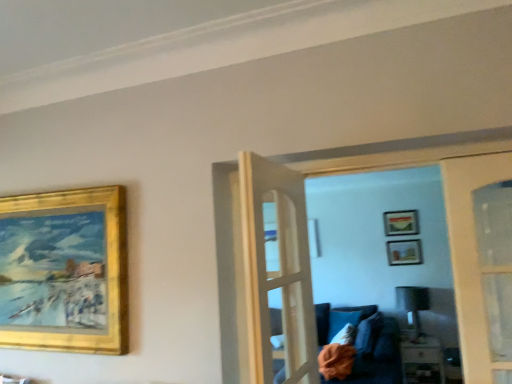
What do you see at coordinates (404, 252) in the screenshot?
I see `matte gold picture frame at upper center, the second picture frame in the front-to-back sequence` at bounding box center [404, 252].

In order to click on matte gold picture frame at upper center, which is counted as the 3th picture frame, starting from the front in this screenshot , I will do `click(401, 222)`.

This screenshot has width=512, height=384. What are the coordinates of `the 1st picture frame behind the matte black lamp at center` in the screenshot? It's located at (404, 252).

Which is behind, matte black lamp at center or matte gold picture frame at upper center, which ranks as the second picture frame in back-to-front order?

matte gold picture frame at upper center, which ranks as the second picture frame in back-to-front order, is further from the camera.

Is matte black lamp at center next to matte gold picture frame at upper center, the second picture frame in the front-to-back sequence?

No.

Based on the photo, which is farther, (400,221) or (83,295)?

The point (400,221) is farther.

This screenshot has height=384, width=512. I want to click on picture frame above the matte gold picture frame at upper center, which is counted as the 3th picture frame, starting from the front (from the image's perspective), so click(68, 268).

Consider the image. Between matte gold picture frame at upper center, acting as the first picture frame starting from the back, and gold/gilded picture frame at upper left, marked as the 3th picture frame in a back-to-front arrangement, which one appears on the right side from the viewer's perspective?

From the viewer's perspective, matte gold picture frame at upper center, acting as the first picture frame starting from the back, appears more on the right side.

Could you tell me if wooden table at lower right is facing white fabric pillow at lower center?

No, wooden table at lower right is not turned towards white fabric pillow at lower center.

Is wooden table at lower right placed right next to white fabric pillow at lower center?

wooden table at lower right and white fabric pillow at lower center are not in contact.

Is point (403, 349) less distant than point (334, 335)?

Yes, it is.

Can you tell me how much wooden table at lower right and white fabric pillow at lower center differ in facing direction?

5.2 degrees separate the facing orientations of wooden table at lower right and white fabric pillow at lower center.

Consider the image. From the image's perspective, is gold/gilded picture frame at upper left, the first picture frame from the left, located beneath white fabric pillow at lower center?

Incorrect, from the image's perspective, gold/gilded picture frame at upper left, the first picture frame from the left, is higher than white fabric pillow at lower center.

From a real-world perspective, does gold/gilded picture frame at upper left, marked as the 3th picture frame in a back-to-front arrangement, sit lower than white fabric pillow at lower center?

No, from a real-world perspective, gold/gilded picture frame at upper left, marked as the 3th picture frame in a back-to-front arrangement, is not beneath white fabric pillow at lower center.

Between gold/gilded picture frame at upper left, the third picture frame in the right-to-left sequence, and white fabric pillow at lower center, which one has smaller width?

gold/gilded picture frame at upper left, the third picture frame in the right-to-left sequence, is thinner.

Could white fabric pillow at lower center be considered to be inside gold/gilded picture frame at upper left, which is counted as the 1th picture frame, starting from the front?

No, gold/gilded picture frame at upper left, which is counted as the 1th picture frame, starting from the front, does not contain white fabric pillow at lower center.

Who is smaller, matte gold picture frame at upper center, acting as the first picture frame starting from the back, or wooden table at lower right?

matte gold picture frame at upper center, acting as the first picture frame starting from the back.

Considering the positions of point (392, 229) and point (419, 341), is point (392, 229) closer or farther from the camera than point (419, 341)?

Point (392, 229) is farther from the camera than point (419, 341).

From a real-world perspective, who is located lower, matte gold picture frame at upper center, acting as the first picture frame starting from the back, or wooden table at lower right?

From a 3D spatial view, wooden table at lower right is below.

Does matte gold picture frame at upper center, which is the second picture frame from right to left, have a greater height compared to wooden table at lower right?

No.

Find the location of a particular element. Image resolution: width=512 pixels, height=384 pixels. the 1st picture frame behind the matte black lamp at center, starting your count from the anchor is located at coordinates (404, 252).

Is the depth of matte gold picture frame at upper center, which ranks as the second picture frame in back-to-front order, greater than that of matte black lamp at center?

That is True.

Consider the image. Does matte gold picture frame at upper center, the third picture frame viewed from the left, have a greater height compared to matte black lamp at center?

No.

Between matte black lamp at center and matte gold picture frame at upper center, positioned as the second picture frame in left-to-right order, which one has smaller size?

matte gold picture frame at upper center, positioned as the second picture frame in left-to-right order.

Is point (410, 299) positioned behind point (385, 229)?

No, (410, 299) is closer to viewer.

How many degrees apart are the facing directions of matte black lamp at center and matte gold picture frame at upper center, which is the second picture frame from right to left?

6.57 degrees separate the facing orientations of matte black lamp at center and matte gold picture frame at upper center, which is the second picture frame from right to left.

From a real-world perspective, between matte black lamp at center and matte gold picture frame at upper center, positioned as the second picture frame in left-to-right order, who is vertically higher?

From a 3D spatial view, matte gold picture frame at upper center, positioned as the second picture frame in left-to-right order, is above.

At what (x,y) coordinates should I click in order to perform the action: click on lamp that appears below the matte gold picture frame at upper center, the second picture frame in the front-to-back sequence (from the image's perspective). Please return your answer as a coordinate pair (x, y). This screenshot has height=384, width=512. Looking at the image, I should click on (412, 307).

You are a GUI agent. You are given a task and a screenshot of the screen. Output one action in this format:
    pyautogui.click(x=<x>, y=<y>)
    Task: Click on the picture frame that is the 1st one below the matte gold picture frame at upper center, acting as the first picture frame starting from the back (from a real-world perspective)
    The width and height of the screenshot is (512, 384).
    Given the screenshot: What is the action you would take?
    pyautogui.click(x=68, y=268)

From the image, which object appears to be nearer to matte gold picture frame at upper center, the second picture frame in the front-to-back sequence, matte black lamp at center or matte gold picture frame at upper center, positioned as the second picture frame in left-to-right order?

matte gold picture frame at upper center, positioned as the second picture frame in left-to-right order, is positioned closer to the anchor matte gold picture frame at upper center, the second picture frame in the front-to-back sequence.

Based on the photo, estimate the real-world distances between objects in this image. Which object is further from matte gold picture frame at upper center, acting as the 1th picture frame starting from the right, wooden table at lower right or matte black lamp at center?

wooden table at lower right is positioned further to the anchor matte gold picture frame at upper center, acting as the 1th picture frame starting from the right.

Estimate the real-world distances between objects in this image. Which object is further from matte gold picture frame at upper center, positioned as the second picture frame in left-to-right order, wooden table at lower right or gold/gilded picture frame at upper left, the first picture frame from the left?

The object further to matte gold picture frame at upper center, positioned as the second picture frame in left-to-right order, is gold/gilded picture frame at upper left, the first picture frame from the left.

From the image, which object appears to be nearer to wooden table at lower right, white fabric pillow at lower center or gold/gilded picture frame at upper left, which is counted as the 1th picture frame, starting from the front?

Based on the image, white fabric pillow at lower center appears to be nearer to wooden table at lower right.

Looking at the image, which one is located closer to wooden table at lower right, gold/gilded picture frame at upper left, the first picture frame from the left, or matte gold picture frame at upper center, the third picture frame viewed from the left?

Among the two, matte gold picture frame at upper center, the third picture frame viewed from the left, is located nearer to wooden table at lower right.

Based on their spatial positions, is white fabric pillow at lower center or matte black lamp at center further from matte gold picture frame at upper center, which is counted as the 3th picture frame, starting from the front?

white fabric pillow at lower center is positioned further to the anchor matte gold picture frame at upper center, which is counted as the 3th picture frame, starting from the front.

Which object lies nearer to the anchor point matte gold picture frame at upper center, acting as the first picture frame starting from the back, white fabric pillow at lower center or gold/gilded picture frame at upper left, the third picture frame in the right-to-left sequence?

white fabric pillow at lower center.

Based on their spatial positions, is matte gold picture frame at upper center, the third picture frame viewed from the left, or wooden table at lower right further from gold/gilded picture frame at upper left, the third picture frame in the right-to-left sequence?

matte gold picture frame at upper center, the third picture frame viewed from the left.

At what (x,y) coordinates should I click in order to perform the action: click on lamp situated between white fabric pillow at lower center and matte gold picture frame at upper center, the second picture frame in the front-to-back sequence, from left to right. Please return your answer as a coordinate pair (x, y). The height and width of the screenshot is (384, 512). Looking at the image, I should click on (412, 307).

You are a GUI agent. You are given a task and a screenshot of the screen. Output one action in this format:
    pyautogui.click(x=<x>, y=<y>)
    Task: Click on the lamp that lies between matte gold picture frame at upper center, which ranks as the second picture frame in back-to-front order, and wooden table at lower right from top to bottom
    Image resolution: width=512 pixels, height=384 pixels.
    Given the screenshot: What is the action you would take?
    pyautogui.click(x=412, y=307)

Locate an element on the screen. This screenshot has height=384, width=512. table positioned between gold/gilded picture frame at upper left, the third picture frame in the right-to-left sequence, and white fabric pillow at lower center from near to far is located at coordinates (422, 361).

At what (x,y) coordinates should I click in order to perform the action: click on lamp between matte gold picture frame at upper center, acting as the first picture frame starting from the back, and wooden table at lower right, in the vertical direction. Please return your answer as a coordinate pair (x, y). Looking at the image, I should click on coord(412,307).